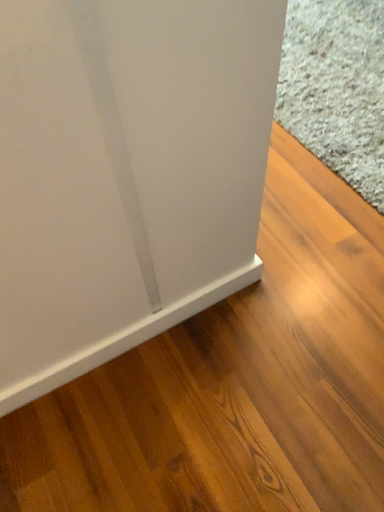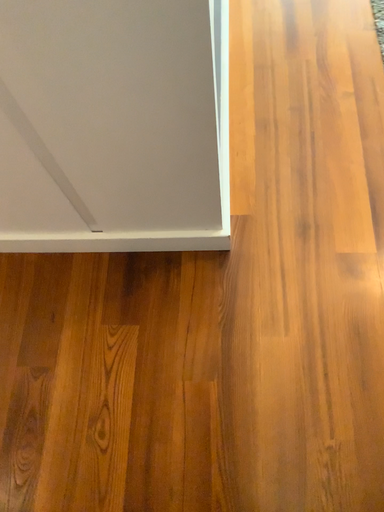
Question: How did the camera likely rotate when shooting the video?

Choices:
 (A) rotated left
 (B) rotated right

Answer: (A)